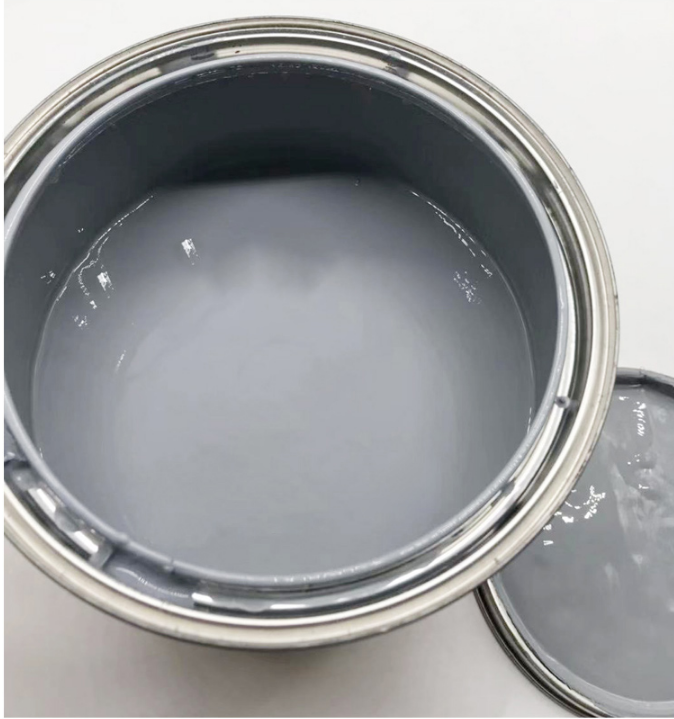
At what (x,y) coordinates should I click in order to perform the action: click on gray paint. Please return your answer as a coordinate pair (x, y). Image resolution: width=674 pixels, height=719 pixels. Looking at the image, I should click on (x=361, y=429).